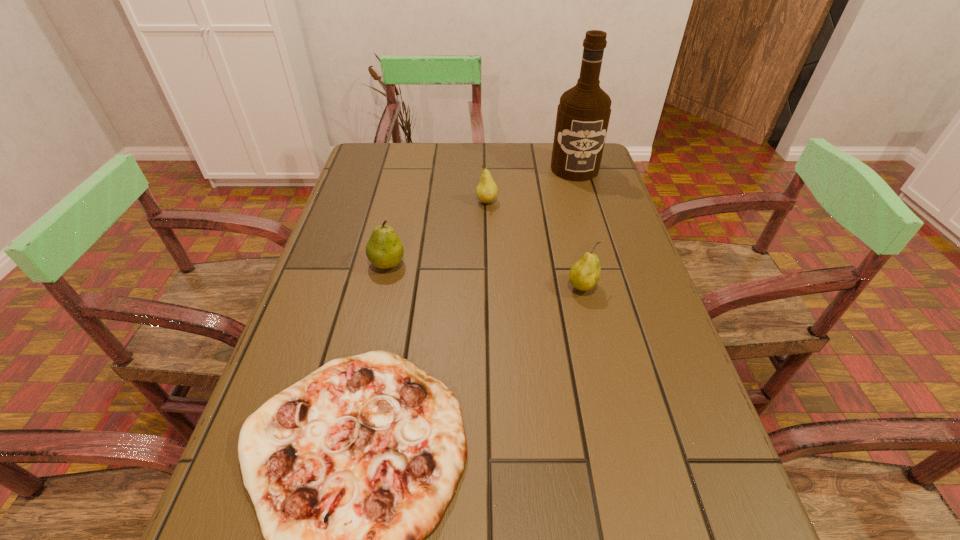
Locate an element on the screen. The height and width of the screenshot is (540, 960). object present at the far edge is located at coordinates (583, 114).

The width and height of the screenshot is (960, 540). I want to click on object that is at the left edge, so click(x=384, y=249).

Find the location of a particular element. The height and width of the screenshot is (540, 960). alcohol that is at the right edge is located at coordinates (583, 114).

Identify the location of pear that is positioned at the right edge. 584,274.

You are a GUI agent. You are given a task and a screenshot of the screen. Output one action in this format:
    pyautogui.click(x=<x>, y=<y>)
    Task: Click on the object situated at the far right corner
    The width and height of the screenshot is (960, 540).
    Given the screenshot: What is the action you would take?
    pyautogui.click(x=583, y=114)

Locate an element on the screen. The image size is (960, 540). vacant position at the far edge of the desktop is located at coordinates coord(416,175).

At what (x,y) coordinates should I click in order to perform the action: click on vacant space at the left edge of the desktop. Please return your answer as a coordinate pair (x, y). Looking at the image, I should click on (238, 494).

Where is `free region at the right edge of the desktop`? This screenshot has height=540, width=960. free region at the right edge of the desktop is located at coordinates (588, 218).

Where is `vacant space at the far left corner`? This screenshot has width=960, height=540. vacant space at the far left corner is located at coordinates (358, 166).

Find the location of a particular element. Image resolution: width=960 pixels, height=540 pixels. free space between the farthest pear and the rightmost pear is located at coordinates pos(535,245).